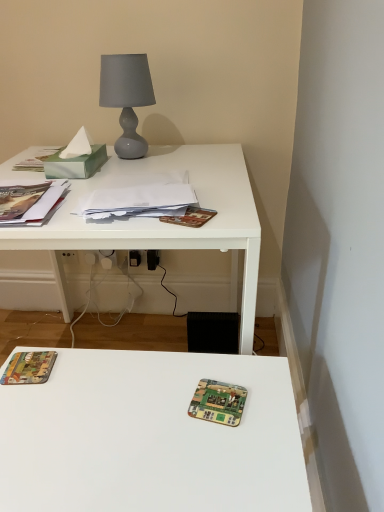
Question: Does white matte desk at upper left contain white paper stack at center?

Choices:
 (A) yes
 (B) no

Answer: (B)

Question: Could you tell me if white matte desk at upper left is turned towards white paper stack at center?

Choices:
 (A) no
 (B) yes

Answer: (A)

Question: Is the surface of white matte desk at upper left in direct contact with white paper stack at center?

Choices:
 (A) no
 (B) yes

Answer: (A)

Question: Is white matte desk at upper left at the left side of white paper stack at center?

Choices:
 (A) yes
 (B) no

Answer: (A)

Question: Is the position of white matte desk at upper left less distant than that of white paper stack at center?

Choices:
 (A) no
 (B) yes

Answer: (B)

Question: Considering the relative positions of green circuit board at center and white matte desk at upper left in the image provided, is green circuit board at center to the left or to the right of white matte desk at upper left?

Choices:
 (A) right
 (B) left

Answer: (A)

Question: Considering the positions of green circuit board at center and white matte desk at upper left in the image, is green circuit board at center bigger or smaller than white matte desk at upper left?

Choices:
 (A) small
 (B) big

Answer: (A)

Question: In terms of height, does green circuit board at center look taller or shorter compared to white matte desk at upper left?

Choices:
 (A) short
 (B) tall

Answer: (A)

Question: From the image's perspective, is green circuit board at center located above or below white matte desk at upper left?

Choices:
 (A) below
 (B) above

Answer: (A)

Question: Considering the positions of point (44, 197) and point (180, 204), is point (44, 197) closer or farther from the camera than point (180, 204)?

Choices:
 (A) closer
 (B) farther

Answer: (B)

Question: Based on their sizes in the image, would you say matte paper book at left is bigger or smaller than white paper stack at center?

Choices:
 (A) big
 (B) small

Answer: (A)

Question: From a real-world perspective, is matte paper book at left above or below white paper stack at center?

Choices:
 (A) above
 (B) below

Answer: (A)

Question: From the image's perspective, relative to white paper stack at center, is matte paper book at left above or below?

Choices:
 (A) above
 (B) below

Answer: (A)

Question: Looking at their shapes, would you say matte gray glass lamp at upper center is wider or thinner than brown textured paper at center, arranged as the second paperback book when viewed from the left?

Choices:
 (A) wide
 (B) thin

Answer: (A)

Question: In the image, is matte gray glass lamp at upper center positioned in front of or behind brown textured paper at center, arranged as the second paperback book when viewed from the left?

Choices:
 (A) behind
 (B) front

Answer: (A)